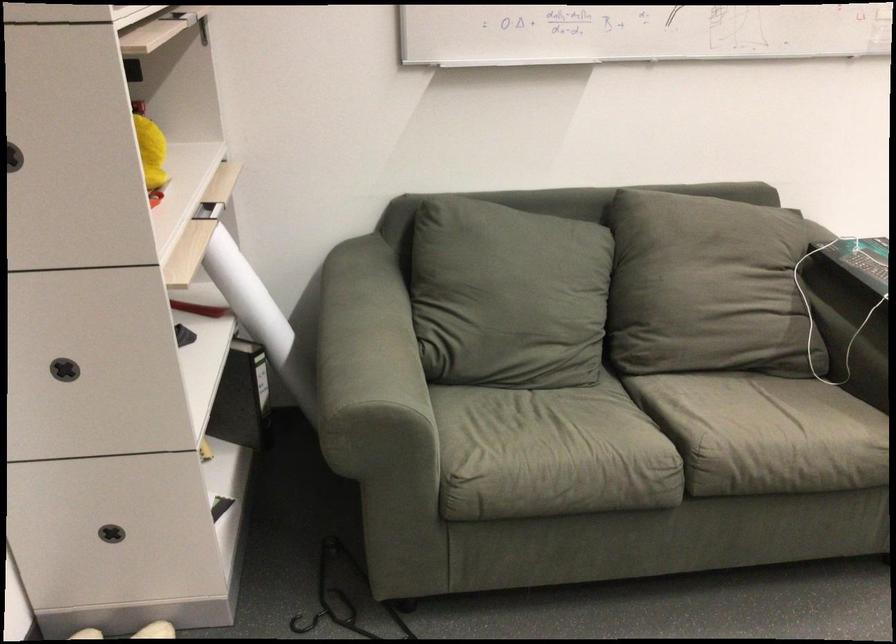
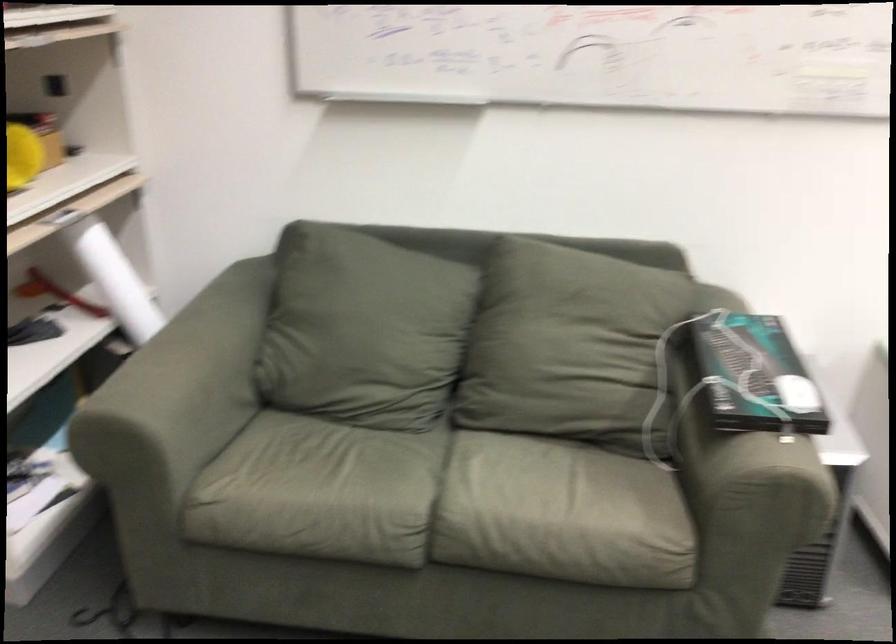
Question: The camera is either moving clockwise (left) or counter-clockwise (right) around the object. The first image is from the beginning of the video and the second image is from the end. Is the camera moving left or right when shooting the video?

Choices:
 (A) Left
 (B) Right

Answer: (B)